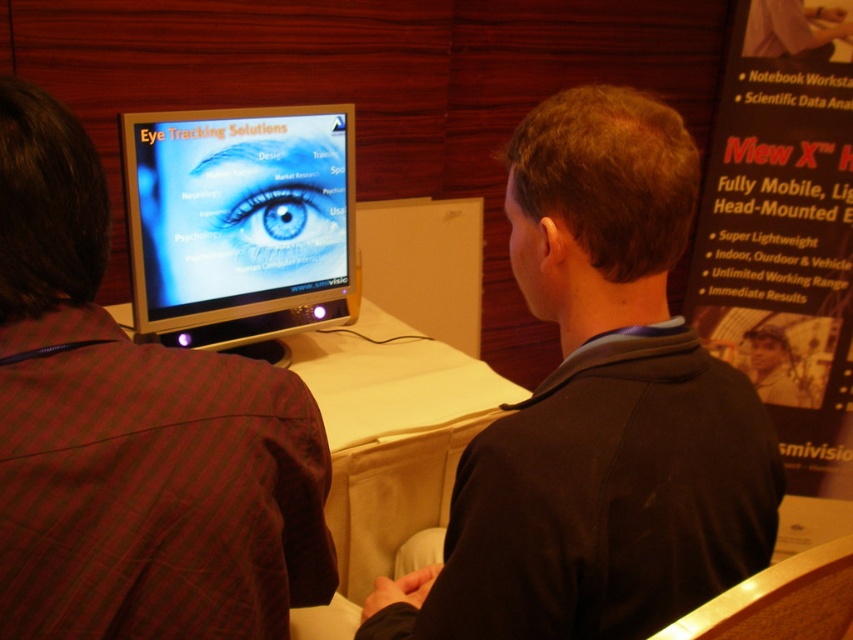
You are designing a layout for a presentation about eye tracking technology. You have the plaid fabric jacket at left and the satin black monitor at center. Which object should you place in a smaller area to maintain visual balance?

The plaid fabric jacket at left should be placed in a smaller area because it occupies less space than the satin black monitor at center, which requires a larger space to maintain visual balance.

You need to place a new keyboard next to the satin black monitor at center. Given that the white fabric table at center is larger, will there be enough space for the keyboard?

The satin black monitor at center occupies less space than the white fabric table at center, so there should be enough space on the white fabric table at center to place the keyboard next to the monitor.

In the scene shown: You are designing a storage space and need to place both the plaid fabric jacket at left and the satin black monitor at center. Given their sizes, which item requires more horizontal space?

The satin black monitor at center requires more horizontal space because its width is greater than the plaid fabric jacket at left.